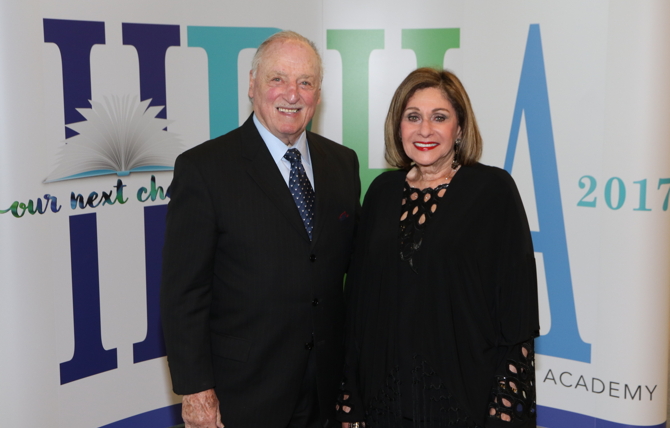
At what (x,y) coordinates should I click in order to perform the action: click on blue book part. Please return your answer as a coordinate pair (x, y). The image size is (670, 428). Looking at the image, I should click on (153, 167), (88, 174).